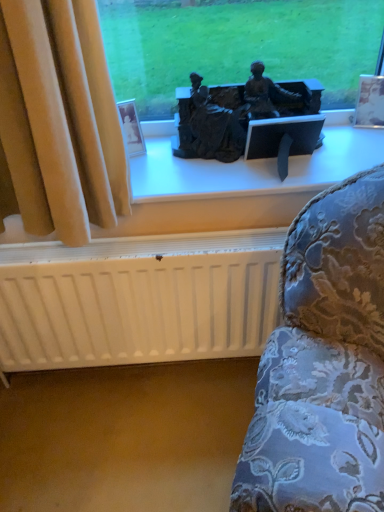
Question: From the image's perspective, is bronze statue at center below white matte radiator at lower center?

Choices:
 (A) no
 (B) yes

Answer: (A)

Question: Considering the relative sizes of bronze statue at center and white matte radiator at lower center in the image provided, is bronze statue at center smaller than white matte radiator at lower center?

Choices:
 (A) no
 (B) yes

Answer: (B)

Question: Does bronze statue at center lie in front of white matte radiator at lower center?

Choices:
 (A) yes
 (B) no

Answer: (A)

Question: Does bronze statue at center have a larger size compared to white matte radiator at lower center?

Choices:
 (A) no
 (B) yes

Answer: (A)

Question: Is bronze statue at center facing away from white matte radiator at lower center?

Choices:
 (A) no
 (B) yes

Answer: (A)

Question: Is bronze statue at center at the right side of white matte radiator at lower center?

Choices:
 (A) no
 (B) yes

Answer: (B)

Question: Can you confirm if matte black statue at center is taller than bronze statue at center?

Choices:
 (A) yes
 (B) no

Answer: (B)

Question: Could you tell me if matte black statue at center is facing bronze statue at center?

Choices:
 (A) no
 (B) yes

Answer: (A)

Question: Would you say bronze statue at center is part of matte black statue at center's contents?

Choices:
 (A) no
 (B) yes

Answer: (A)

Question: Considering the relative positions of matte black statue at center and bronze statue at center in the image provided, is matte black statue at center to the right of bronze statue at center from the viewer's perspective?

Choices:
 (A) no
 (B) yes

Answer: (A)

Question: From a real-world perspective, is matte black statue at center below bronze statue at center?

Choices:
 (A) yes
 (B) no

Answer: (A)

Question: Does matte black statue at center have a larger size compared to bronze statue at center?

Choices:
 (A) yes
 (B) no

Answer: (A)

Question: Considering the relative sizes of matte black statue at center and white matte radiator at lower center in the image provided, is matte black statue at center bigger than white matte radiator at lower center?

Choices:
 (A) no
 (B) yes

Answer: (A)